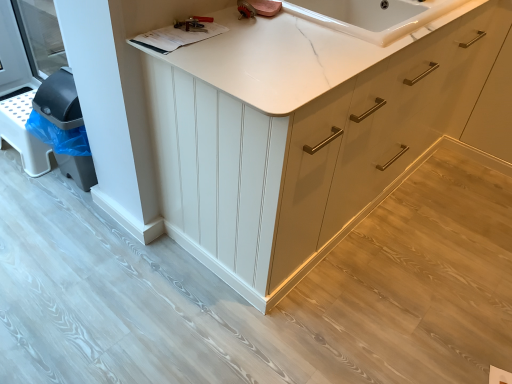
Question: Is white marble countertop at upper center not near metallic silver wrench at upper center?

Choices:
 (A) yes
 (B) no

Answer: (B)

Question: Is white marble countertop at upper center facing towards metallic silver wrench at upper center?

Choices:
 (A) no
 (B) yes

Answer: (A)

Question: Is white marble countertop at upper center closer to camera compared to metallic silver wrench at upper center?

Choices:
 (A) no
 (B) yes

Answer: (B)

Question: Is white marble countertop at upper center at the left side of metallic silver wrench at upper center?

Choices:
 (A) no
 (B) yes

Answer: (A)

Question: Can you confirm if white marble countertop at upper center is shorter than metallic silver wrench at upper center?

Choices:
 (A) no
 (B) yes

Answer: (A)

Question: Looking at their shapes, would you say metallic silver wrench at upper center is wider or thinner than white marble countertop at upper center?

Choices:
 (A) thin
 (B) wide

Answer: (A)

Question: In the image, is metallic silver wrench at upper center positioned in front of or behind white marble countertop at upper center?

Choices:
 (A) front
 (B) behind

Answer: (B)

Question: From a real-world perspective, is metallic silver wrench at upper center above or below white marble countertop at upper center?

Choices:
 (A) below
 (B) above

Answer: (B)

Question: From the image's perspective, is metallic silver wrench at upper center located above or below white marble countertop at upper center?

Choices:
 (A) below
 (B) above

Answer: (A)

Question: Considering their positions, is metallic silver wrench at upper center located in front of or behind matte white cabinet at center?

Choices:
 (A) behind
 (B) front

Answer: (A)

Question: In terms of size, does metallic silver wrench at upper center appear bigger or smaller than matte white cabinet at center?

Choices:
 (A) big
 (B) small

Answer: (B)

Question: Does point (206, 29) appear closer or farther from the camera than point (462, 41)?

Choices:
 (A) closer
 (B) farther

Answer: (A)

Question: In terms of width, does metallic silver wrench at upper center look wider or thinner when compared to matte white cabinet at center?

Choices:
 (A) wide
 (B) thin

Answer: (B)

Question: From their relative heights in the image, would you say matte white cabinet at center is taller or shorter than metallic silver wrench at upper center?

Choices:
 (A) tall
 (B) short

Answer: (A)

Question: Would you say matte white cabinet at center is to the left or to the right of metallic silver wrench at upper center in the picture?

Choices:
 (A) right
 (B) left

Answer: (A)